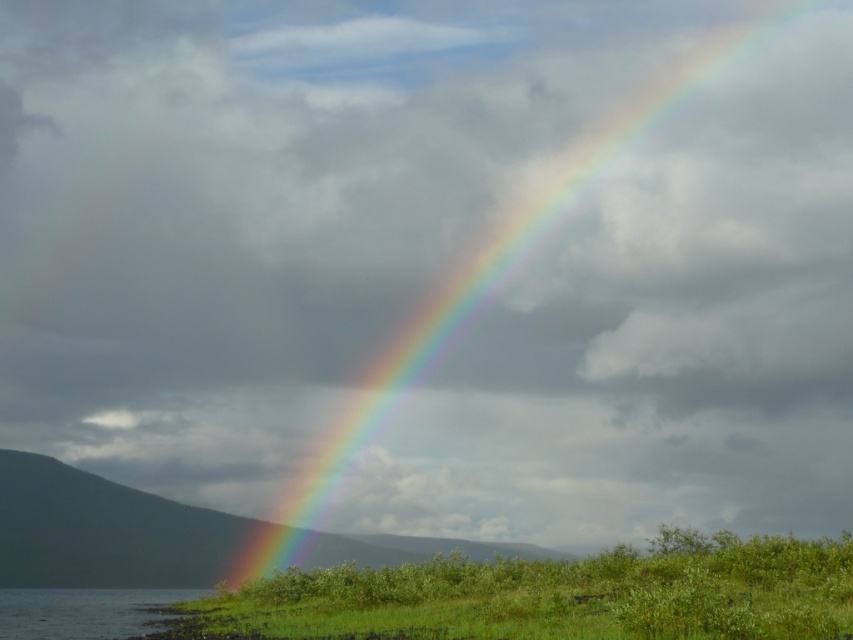
Does rainbow at upper center lie in front of clear water at lower left?

No, rainbow at upper center is behind clear water at lower left.

Which is more to the left, rainbow at upper center or clear water at lower left?

From the viewer's perspective, clear water at lower left appears more on the left side.

Describe the element at coordinates (500, 260) in the screenshot. The width and height of the screenshot is (853, 640). I see `rainbow at upper center` at that location.

Identify the location of rainbow at upper center. point(500,260).

Which is more to the left, green leafy shrubs at lower center or clear water at lower left?

Positioned to the left is clear water at lower left.

Between green leafy shrubs at lower center and clear water at lower left, which one has less height?

Standing shorter between the two is clear water at lower left.

Which is behind, point (384, 628) or point (39, 598)?

The point (39, 598) is more distant.

The image size is (853, 640). I want to click on green leafy shrubs at lower center, so click(553, 595).

Does green leafy shrubs at lower center have a smaller size compared to rainbow at upper center?

Correct, green leafy shrubs at lower center occupies less space than rainbow at upper center.

Does point (585, 630) come in front of point (486, 250)?

Yes, it is.

Image resolution: width=853 pixels, height=640 pixels. I want to click on green leafy shrubs at lower center, so click(x=553, y=595).